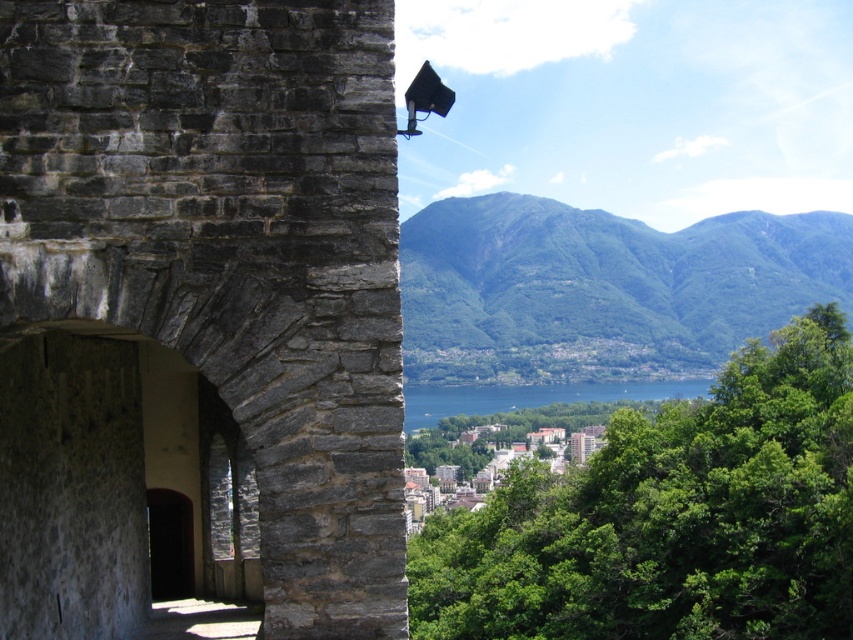
Question: Estimate the real-world distances between objects in this image. Which object is closer to the gray stone arch at center?

Choices:
 (A) green leafy tree at center
 (B) blue water at center

Answer: (A)

Question: Estimate the real-world distances between objects in this image. Which object is farther from the green leafy mountain at upper center?

Choices:
 (A) gray stone arch at center
 (B) green leafy tree at center

Answer: (B)

Question: Is gray stone arch at center to the left of green leafy mountain at upper center from the viewer's perspective?

Choices:
 (A) yes
 (B) no

Answer: (A)

Question: Does green leafy tree at center have a greater width compared to blue water at center?

Choices:
 (A) yes
 (B) no

Answer: (B)

Question: Does gray stone arch at center come in front of blue water at center?

Choices:
 (A) no
 (B) yes

Answer: (B)

Question: Among these objects, which one is nearest to the camera?

Choices:
 (A) blue water at center
 (B) gray stone arch at center
 (C) green leafy mountain at upper center
 (D) green leafy tree at center

Answer: (B)